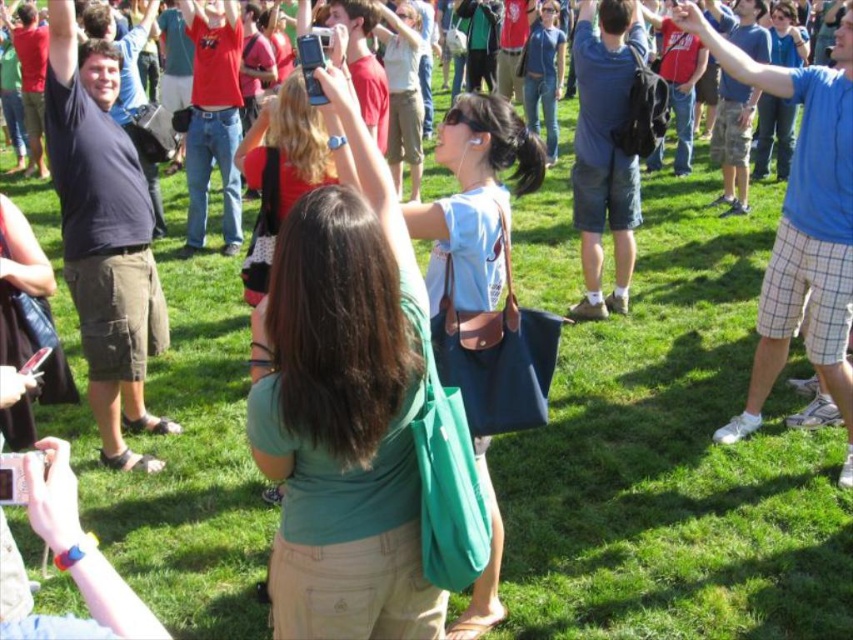
Measure the distance between matte green bag at center and camera.

A distance of 6.92 feet exists between matte green bag at center and camera.

Image resolution: width=853 pixels, height=640 pixels. I want to click on matte green bag at center, so click(343, 403).

Is point (368, 416) in front of point (583, 33)?

Yes, point (368, 416) is in front of point (583, 33).

Image resolution: width=853 pixels, height=640 pixels. What are the coordinates of `matte green bag at center` in the screenshot? It's located at (343, 403).

Between matte green bag at center and blue plaid shorts at right, which one appears on the right side from the viewer's perspective?

blue plaid shorts at right

Between matte green bag at center and blue plaid shorts at right, which one has less height?

With less height is matte green bag at center.

Who is more distant from viewer, (404, 465) or (741, 52)?

Point (741, 52)

Where is `matte green bag at center`? This screenshot has height=640, width=853. matte green bag at center is located at coordinates (343, 403).

Which of these two, blue plaid shorts at right or blue denim shorts at center, stands shorter?

blue denim shorts at center is shorter.

Who is positioned more to the right, blue plaid shorts at right or blue denim shorts at center?

From the viewer's perspective, blue plaid shorts at right appears more on the right side.

Locate an element on the screen. Image resolution: width=853 pixels, height=640 pixels. blue plaid shorts at right is located at coordinates (802, 227).